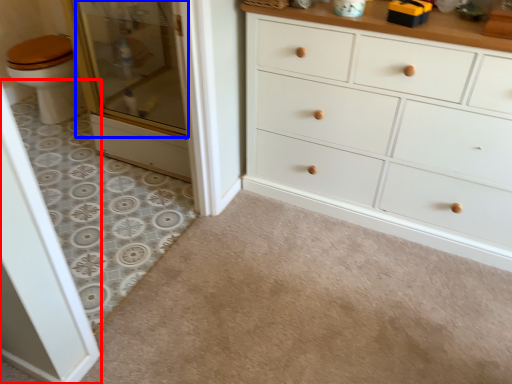
Question: Which of the following is the farthest to the observer, screen door (highlighted by a red box) or screen door (highlighted by a blue box)?

Choices:
 (A) screen door
 (B) screen door

Answer: (B)